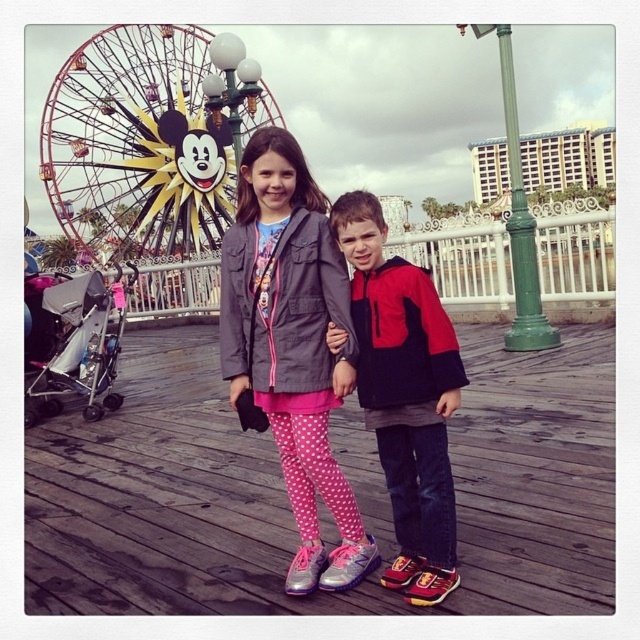
Question: Which point is farther to the camera?

Choices:
 (A) pink polka dot leggings at center
 (B) metallic ferris wheel at upper left
 (C) pink fabric pants at center

Answer: (B)

Question: Does metallic ferris wheel at upper left appear under pink polka dot leggings at center?

Choices:
 (A) yes
 (B) no

Answer: (B)

Question: Which point appears farthest from the camera in this image?

Choices:
 (A) [189, 205]
 (B) [369, 248]

Answer: (A)

Question: Can you confirm if pink polka dot leggings at center is positioned below red/black jacket at center?

Choices:
 (A) yes
 (B) no

Answer: (A)

Question: Is pink fabric pants at center further to camera compared to red/black jacket at center?

Choices:
 (A) no
 (B) yes

Answer: (A)

Question: Which point appears farthest from the camera in this image?

Choices:
 (A) (147, 172)
 (B) (285, 392)
 (C) (120, 470)

Answer: (A)